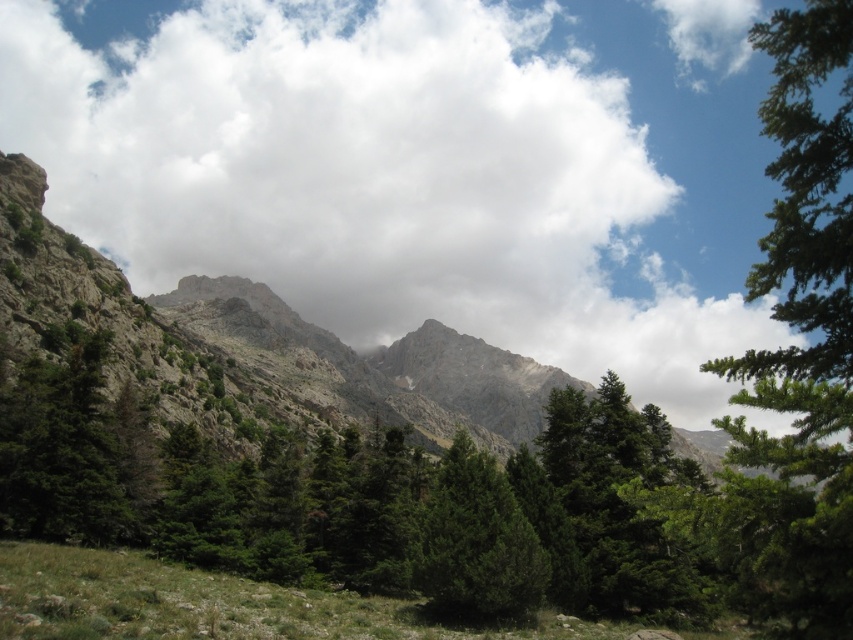
Can you confirm if green matte tree at left is wider than green matte tree at center?

Yes, green matte tree at left is wider than green matte tree at center.

Does green matte tree at left appear over green matte tree at center?

Indeed, green matte tree at left is positioned over green matte tree at center.

Describe the element at coordinates (61, 451) in the screenshot. I see `green matte tree at left` at that location.

Image resolution: width=853 pixels, height=640 pixels. I want to click on green matte tree at left, so click(61, 451).

Does white fluffy cloud at upper center come in front of green matte tree at left?

No.

The width and height of the screenshot is (853, 640). Identify the location of white fluffy cloud at upper center. (422, 166).

Where is `white fluffy cloud at upper center`? white fluffy cloud at upper center is located at coordinates (422, 166).

Does white fluffy cloud at upper center have a lesser height compared to green matte tree at center?

Incorrect, white fluffy cloud at upper center's height does not fall short of green matte tree at center's.

Can you confirm if white fluffy cloud at upper center is positioned to the right of green matte tree at center?

No, white fluffy cloud at upper center is not to the right of green matte tree at center.

This screenshot has height=640, width=853. I want to click on white fluffy cloud at upper center, so click(422, 166).

Locate an element on the screen. This screenshot has height=640, width=853. white fluffy cloud at upper center is located at coordinates [x=422, y=166].